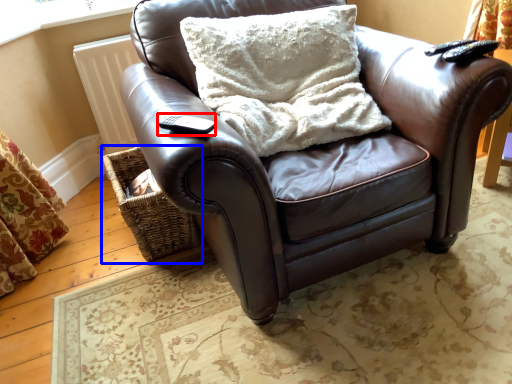
Question: Which object appears closest to the camera in this image, remote (highlighted by a red box) or basket (highlighted by a blue box)?

Choices:
 (A) remote
 (B) basket

Answer: (A)